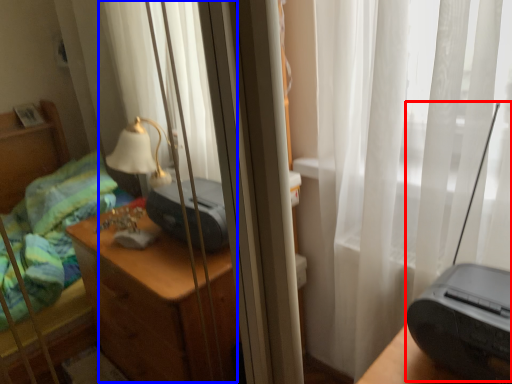
Question: Among these objects, which one is farthest to the camera, equipment (highlighted by a red box) or curtain (highlighted by a blue box)?

Choices:
 (A) equipment
 (B) curtain

Answer: (B)